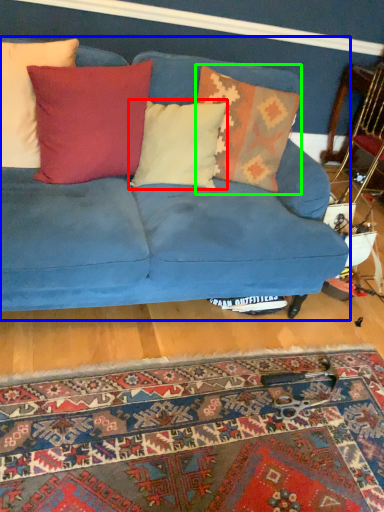
Question: Based on their relative distances, which object is nearer to pillow (highlighted by a red box)? Choose from studio couch (highlighted by a blue box) and pillow (highlighted by a green box).

Choices:
 (A) studio couch
 (B) pillow

Answer: (B)